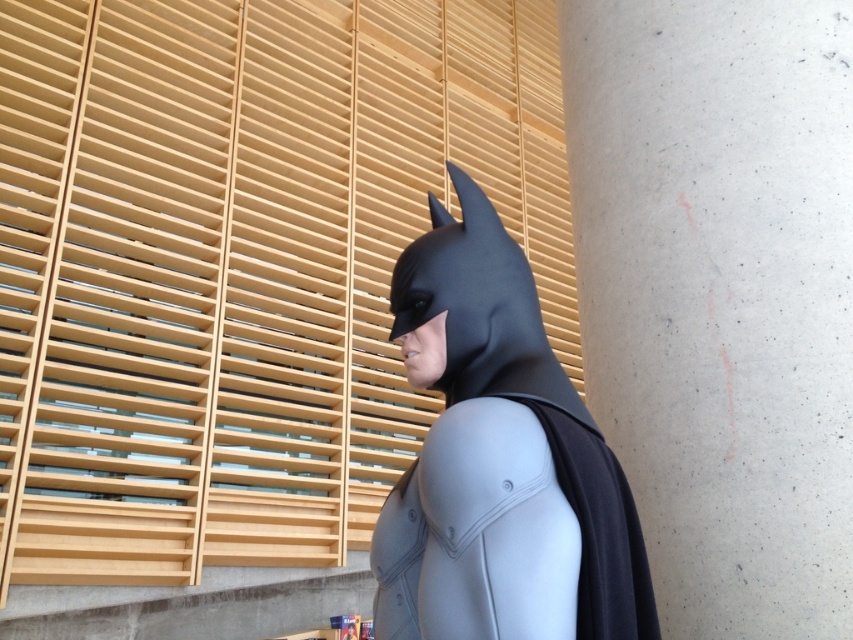
Who is higher up, concrete textured pillar at right or matte black costume at center?

Positioned higher is concrete textured pillar at right.

Who is more forward, (671, 291) or (645, 561)?

Point (645, 561) is more forward.

Who is more forward, (699, 509) or (451, 480)?

Point (451, 480) is more forward.

The image size is (853, 640). In order to click on concrete textured pillar at right in this screenshot , I will do `click(720, 296)`.